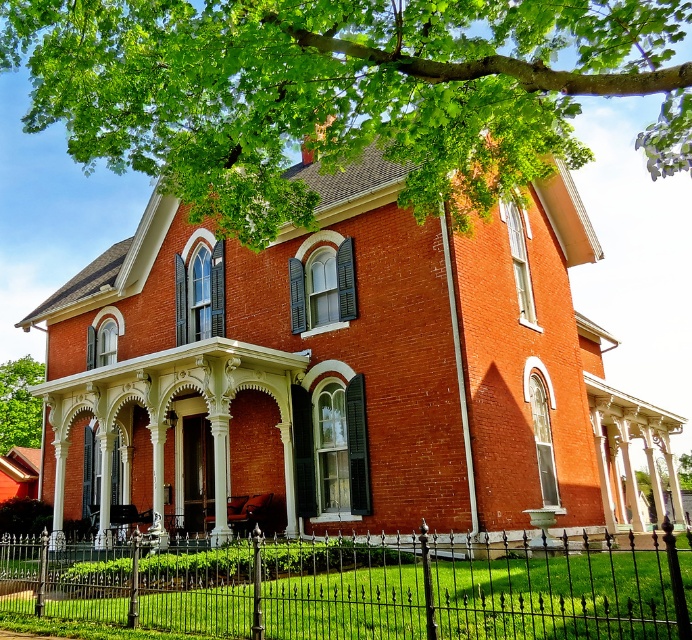
Question: Does black wrought iron fence at lower center have a larger size compared to green leafy tree at center?

Choices:
 (A) yes
 (B) no

Answer: (A)

Question: Estimate the real-world distances between objects in this image. Which object is closer to the green leafy tree at center?

Choices:
 (A) black wrought iron fence at lower center
 (B) green leafy tree at upper center

Answer: (A)

Question: In this image, where is black wrought iron fence at lower center located relative to green leafy tree at center?

Choices:
 (A) below
 (B) above

Answer: (A)

Question: Is black wrought iron fence at lower center closer to camera compared to green leafy tree at center?

Choices:
 (A) no
 (B) yes

Answer: (B)

Question: Estimate the real-world distances between objects in this image. Which object is farther from the green leafy tree at center?

Choices:
 (A) black wrought iron fence at lower center
 (B) green leafy tree at upper center

Answer: (B)

Question: Among these objects, which one is nearest to the camera?

Choices:
 (A) green leafy tree at center
 (B) green leafy tree at upper center

Answer: (B)